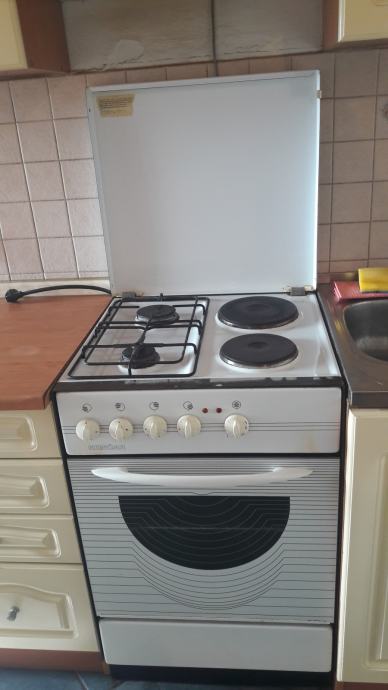
Find the location of a particular element. The width and height of the screenshot is (388, 690). silver drawer pull is located at coordinates (12, 617).